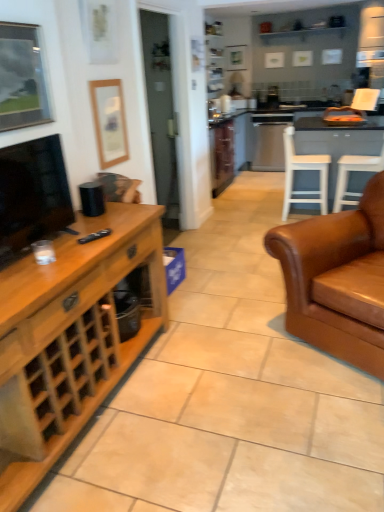
You are a GUI agent. You are given a task and a screenshot of the screen. Output one action in this format:
    pyautogui.click(x=<x>, y=<y>)
    Task: Click on the vacant space behind black matte remote at center
    
    Given the screenshot: What is the action you would take?
    pyautogui.click(x=102, y=225)